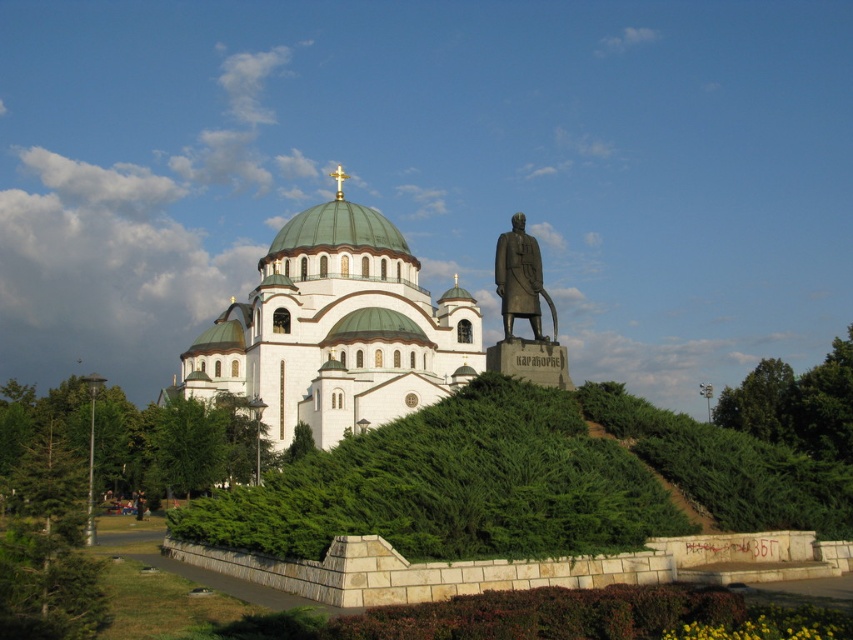
Question: Which object is closer to the camera taking this photo?

Choices:
 (A) bronze statue at right
 (B) white stone church at center

Answer: (A)

Question: Which point is closer to the camera taking this photo?

Choices:
 (A) (260, 305)
 (B) (503, 243)

Answer: (B)

Question: Where is white stone church at center located in relation to bronze statue at right in the image?

Choices:
 (A) left
 (B) right

Answer: (A)

Question: Is white stone church at center to the right of bronze statue at right from the viewer's perspective?

Choices:
 (A) no
 (B) yes

Answer: (A)

Question: Does white stone church at center appear on the left side of bronze statue at right?

Choices:
 (A) yes
 (B) no

Answer: (A)